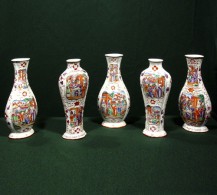
You are a GUI agent. You are given a task and a screenshot of the screen. Output one action in this format:
    pyautogui.click(x=<x>, y=<y>)
    Task: Click on the vase base
    
    Given the screenshot: What is the action you would take?
    pyautogui.click(x=19, y=136), pyautogui.click(x=74, y=136), pyautogui.click(x=112, y=126), pyautogui.click(x=153, y=135), pyautogui.click(x=194, y=129)